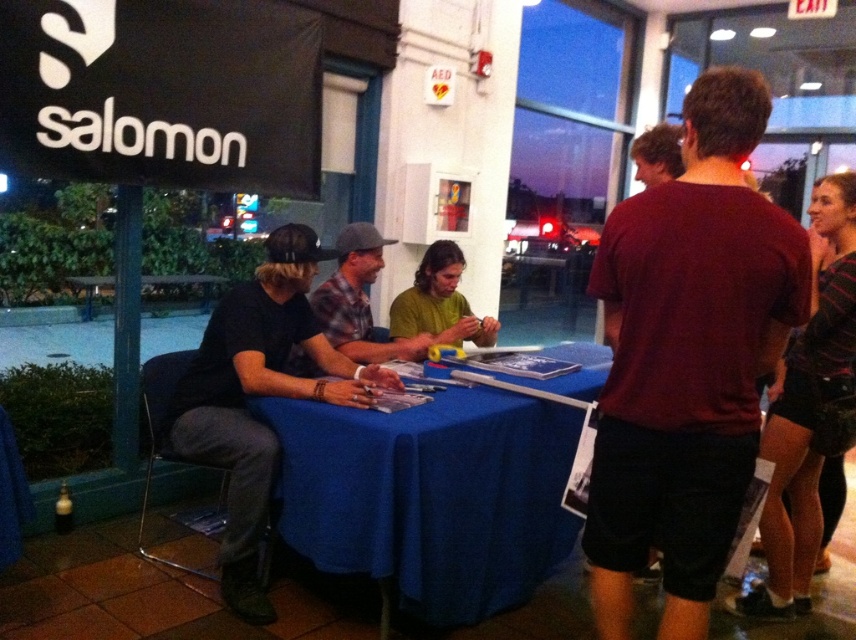
Question: Is black cotton shirt at center bigger than green matte shirt at center?

Choices:
 (A) yes
 (B) no

Answer: (A)

Question: Can you confirm if matte black shirt at center is positioned to the right of green matte shirt at upper center?

Choices:
 (A) yes
 (B) no

Answer: (B)

Question: Which object is positioned closest to the matte black shirt at center?

Choices:
 (A) blue fabric table at center
 (B) green matte shirt at upper center
 (C) black cotton shirt at center
 (D) green matte shirt at center

Answer: (D)

Question: Which point is closer to the camera taking this photo?

Choices:
 (A) (455, 340)
 (B) (652, 154)
 (C) (700, 412)

Answer: (C)

Question: Which point is closer to the camera?

Choices:
 (A) (750, 280)
 (B) (366, 358)

Answer: (A)

Question: Is maroon t-shirt at center above black cotton shirt at center?

Choices:
 (A) no
 (B) yes

Answer: (B)